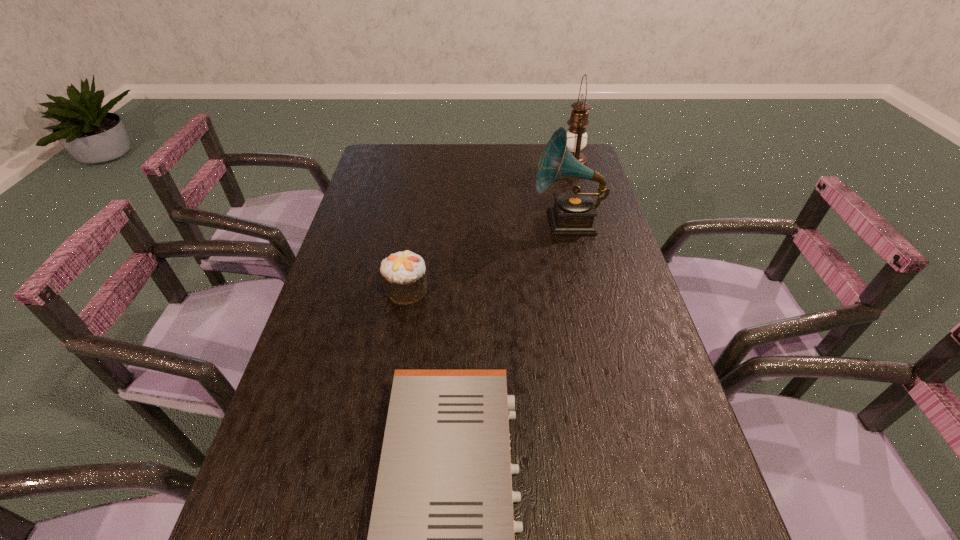
The height and width of the screenshot is (540, 960). I want to click on oil lamp at the right edge, so click(576, 134).

What are the coordinates of `phonograph_record located in the right edge section of the desktop` in the screenshot? It's located at (573, 213).

The width and height of the screenshot is (960, 540). What are the coordinates of `object positioned at the far right corner` in the screenshot? It's located at (576, 134).

At what (x,y) coordinates should I click in order to perform the action: click on free region at the far edge of the desktop. Please return your answer as a coordinate pair (x, y). The height and width of the screenshot is (540, 960). Looking at the image, I should click on (513, 147).

This screenshot has width=960, height=540. In the image, there is a desktop. Identify the location of vacant area at the left edge. (261, 468).

Where is `vacant position at the right edge of the desktop`? This screenshot has height=540, width=960. vacant position at the right edge of the desktop is located at coordinates (626, 276).

Identify the location of vacant position at the far left corner of the desktop. The width and height of the screenshot is (960, 540). (397, 160).

The width and height of the screenshot is (960, 540). In order to click on vacant space that's between the farthest object and the third tallest object in this screenshot , I will do `click(490, 228)`.

Locate an element on the screen. The width and height of the screenshot is (960, 540). free space between the third nearest object and the third farthest object is located at coordinates (487, 256).

Locate an element on the screen. The height and width of the screenshot is (540, 960). empty space that is in between the phonograph_record and the second shortest object is located at coordinates (487, 256).